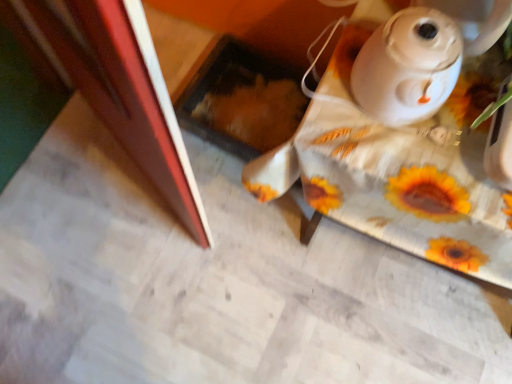
In order to face white glossy kettle at upper right, should I rotate leftwards or rightwards?

A 19.908 degree turn to the right will do.

The width and height of the screenshot is (512, 384). Find the location of `white glossy kettle at upper right`. white glossy kettle at upper right is located at coordinates (407, 67).

The width and height of the screenshot is (512, 384). What do you see at coordinates (407, 67) in the screenshot?
I see `white glossy kettle at upper right` at bounding box center [407, 67].

This screenshot has height=384, width=512. Find the location of `white glossy kettle at upper right`. white glossy kettle at upper right is located at coordinates (407, 67).